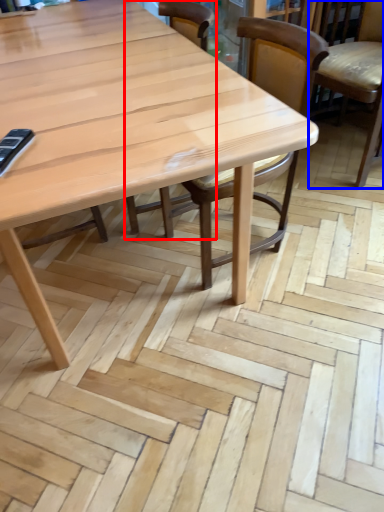
Question: Which point is further to the camera, chair (highlighted by a red box) or chair (highlighted by a blue box)?

Choices:
 (A) chair
 (B) chair

Answer: (B)